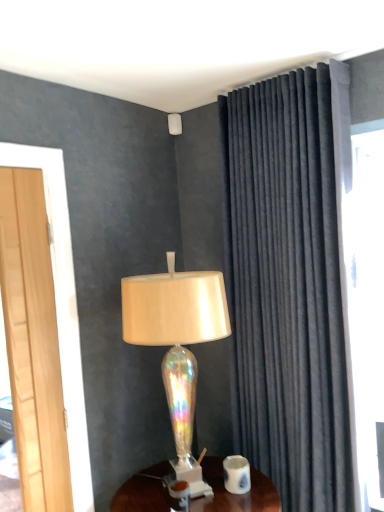
Question: Based on their positions, is wooden desk at center located to the left or right of velvet dark gray curtain at right?

Choices:
 (A) right
 (B) left

Answer: (B)

Question: Looking at their shapes, would you say wooden desk at center is wider or thinner than velvet dark gray curtain at right?

Choices:
 (A) wide
 (B) thin

Answer: (A)

Question: Which object is the closest to the wooden desk at center?

Choices:
 (A) velvet dark gray curtain at right
 (B) iridescent glass lamp at center, the second lamp in the back-to-front sequence
 (C) iridescent glass lampshade at upper center, which is counted as the 2th lamp, starting from the bottom
 (D) white glossy coffee cup at lower center

Answer: (D)

Question: Which is nearer to the wooden desk at center?

Choices:
 (A) white glossy coffee cup at lower center
 (B) iridescent glass lamp at center, the second lamp in the back-to-front sequence
 (C) velvet dark gray curtain at right
 (D) iridescent glass lampshade at upper center, which is counted as the 2th lamp, starting from the bottom

Answer: (A)